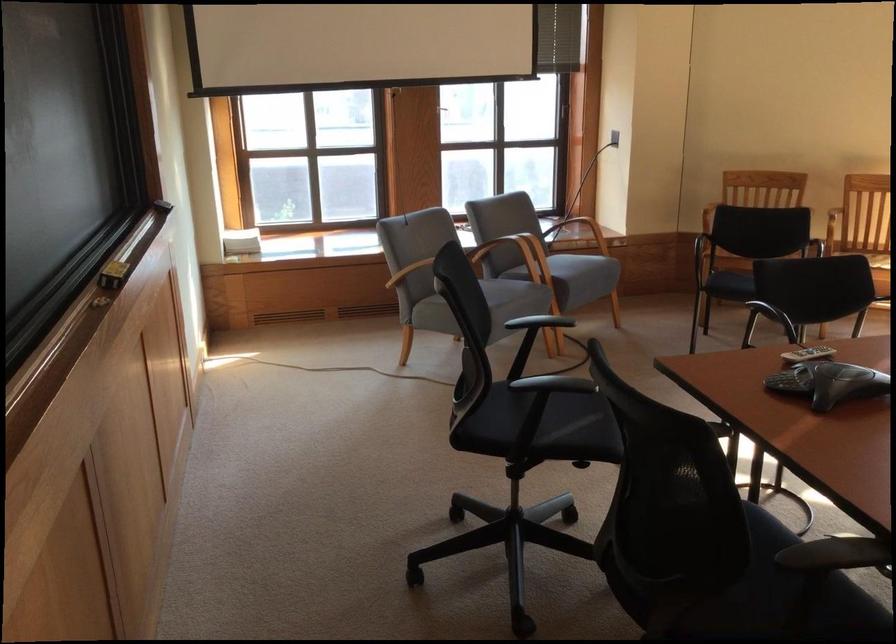
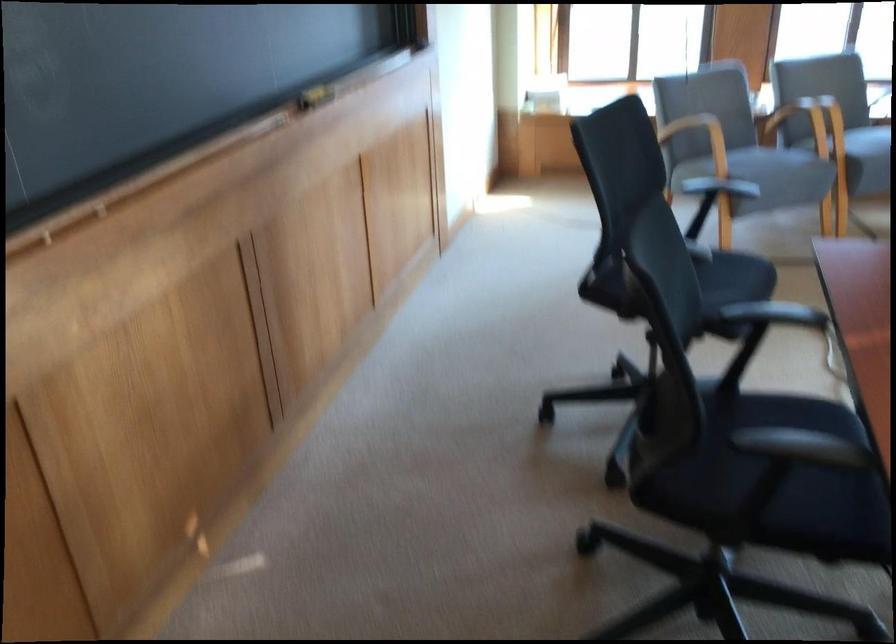
In the second image, find the point that corresponds to point (110, 278) in the first image.

(314, 96)